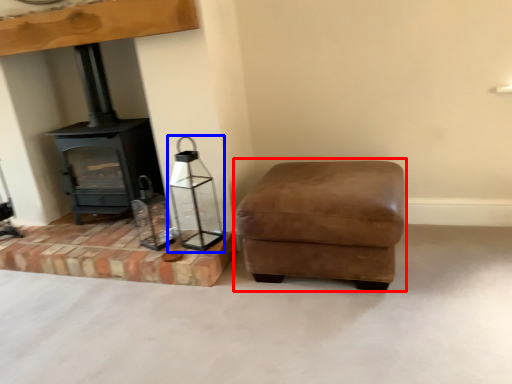
Question: Which point is further to the camera, rocking chair (highlighted by a red box) or candle holder (highlighted by a blue box)?

Choices:
 (A) rocking chair
 (B) candle holder

Answer: (B)